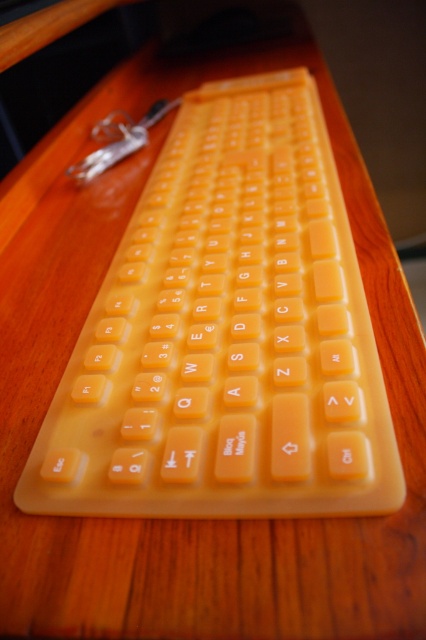
You need to place a sticker that is 10 cm wide on either the yellow rubber keyboard at center or the matte orange key at upper left. Based on their sizes, which object can the sticker fit on without overlapping the edges?

The yellow rubber keyboard at center has a larger width than the matte orange key at upper left, so the sticker can fit on the yellow rubber keyboard at center without overlapping the edges.

You are a delivery robot with a package that is 30 centimeters wide. You need to place the package on the desk without covering the yellow rubber keyboard at center. Is there enough space on the desk next to the keyboard?

The yellow rubber keyboard at center is 32.94 centimeters away from the viewer. Since the package is 30 centimeters wide, there should be sufficient space on the desk next to the keyboard to place it without covering the keyboard.

You are organizing items on a desk and notice the yellow rubber keyboard at center and the matte orange key at upper left. Which object is located below the other?

The yellow rubber keyboard at center is positioned under the matte orange key at upper left, so the keyboard is below the key.